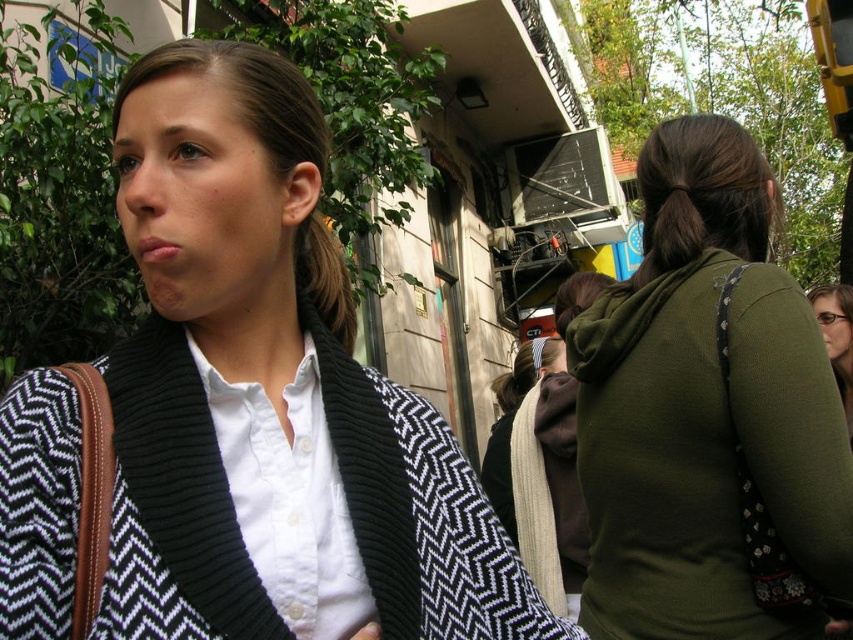
Which is more to the right, white matte shirt at center or black textured sweater at upper left?

white matte shirt at center is more to the right.

Can you confirm if white matte shirt at center is bigger than black textured sweater at upper left?

No, white matte shirt at center is not bigger than black textured sweater at upper left.

At what (x,y) coordinates should I click in order to perform the action: click on white matte shirt at center. Please return your answer as a coordinate pair (x, y). The image size is (853, 640). Looking at the image, I should click on (289, 499).

Locate an element on the screen. This screenshot has width=853, height=640. white matte shirt at center is located at coordinates (289, 499).

Looking at this image, is the position of green fabric hoodie at upper right more distant than that of brown hair at upper left?

Yes, it is.

Between green fabric hoodie at upper right and brown hair at upper left, which one is positioned lower?

Positioned lower is green fabric hoodie at upper right.

The width and height of the screenshot is (853, 640). Find the location of `green fabric hoodie at upper right`. green fabric hoodie at upper right is located at coordinates (704, 406).

Who is more forward, (654, 243) or (817, 308)?

Positioned in front is point (654, 243).

Which of these two, green fabric hoodie at upper right or matte black sweater at center, stands taller?

With more height is green fabric hoodie at upper right.

Who is more distant from viewer, (599, 618) or (850, 422)?

The point (850, 422) is more distant.

Locate an element on the screen. Image resolution: width=853 pixels, height=640 pixels. green fabric hoodie at upper right is located at coordinates [x=704, y=406].